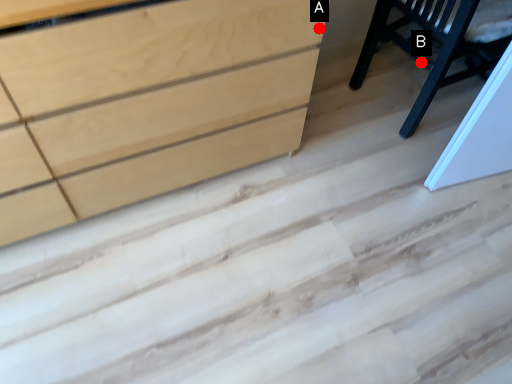
Question: Two points are circled on the image, labeled by A and B beside each circle. Among these points, which one is nearest to the camera?

Choices:
 (A) A is closer
 (B) B is closer

Answer: (A)